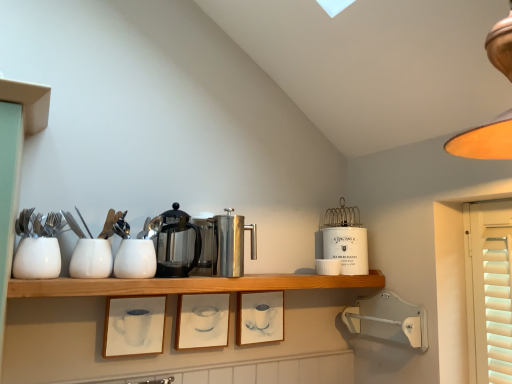
Locate an element on the screen. vacant space to the right of satin silver carafe at center, which is the 2th appliance from back to front is located at coordinates (246, 277).